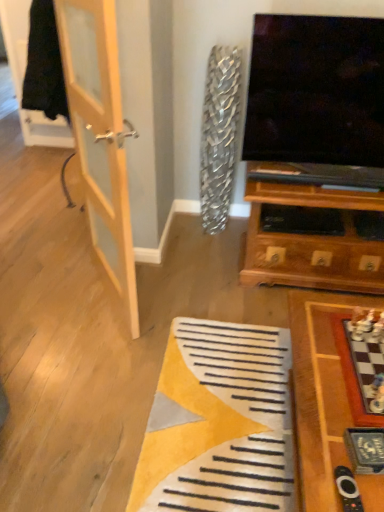
Question: From a real-world perspective, is wooden chessboard at lower right above or below black plastic remote at lower right?

Choices:
 (A) below
 (B) above

Answer: (A)

Question: Looking at the image, does wooden chessboard at lower right seem bigger or smaller compared to black plastic remote at lower right?

Choices:
 (A) big
 (B) small

Answer: (A)

Question: Estimate the real-world distances between objects in this image. Which object is farther from the wooden chessboard at lower right?

Choices:
 (A) black plastic remote at lower right
 (B) light wood door at left

Answer: (B)

Question: Estimate the real-world distances between objects in this image. Which object is farther from the light wood door at left?

Choices:
 (A) wooden chessboard at lower right
 (B) black plastic remote at lower right

Answer: (B)